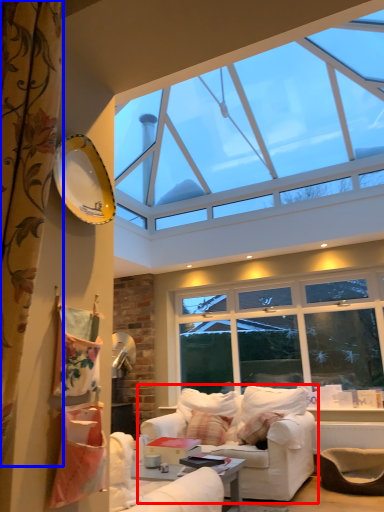
Question: Which object appears farthest to the camera in this image, studio couch (highlighted by a red box) or curtain (highlighted by a blue box)?

Choices:
 (A) studio couch
 (B) curtain

Answer: (A)